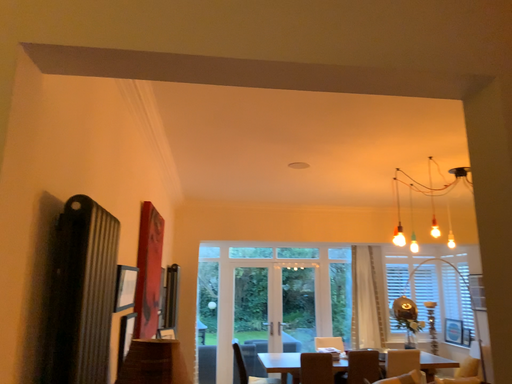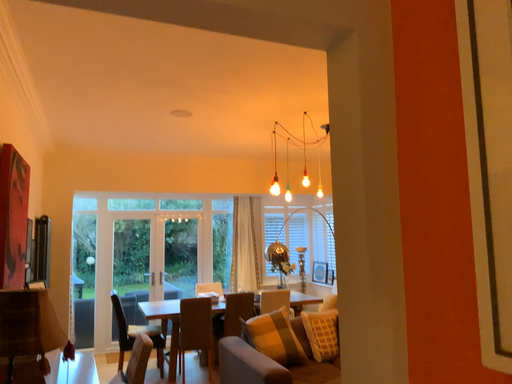
Question: How did the camera likely rotate when shooting the video?

Choices:
 (A) rotated right
 (B) rotated left

Answer: (A)